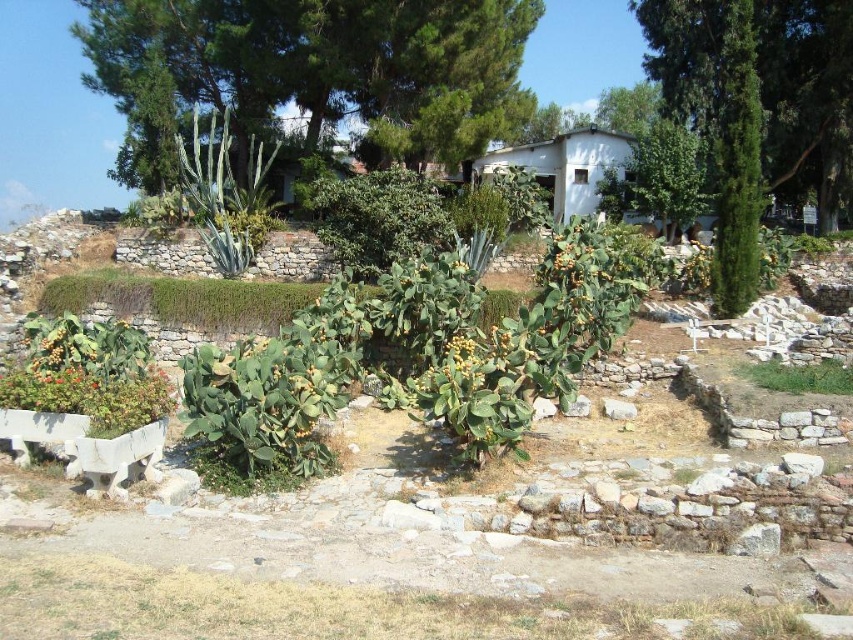
Question: Can you confirm if green leafy tree at upper center is wider than green leafy tree at upper right?

Choices:
 (A) yes
 (B) no

Answer: (A)

Question: Which point is farther from the camera taking this photo?

Choices:
 (A) (401, 67)
 (B) (776, 33)

Answer: (B)

Question: From the image, what is the correct spatial relationship of green leafy tree at upper center in relation to green leafy tree at upper right?

Choices:
 (A) above
 (B) below

Answer: (A)

Question: Which of the following is the closest to the observer?

Choices:
 (A) green leafy tree at upper right
 (B) green leafy tree at upper center

Answer: (B)

Question: Is green leafy tree at upper center positioned behind green leafy tree at upper right?

Choices:
 (A) yes
 (B) no

Answer: (B)